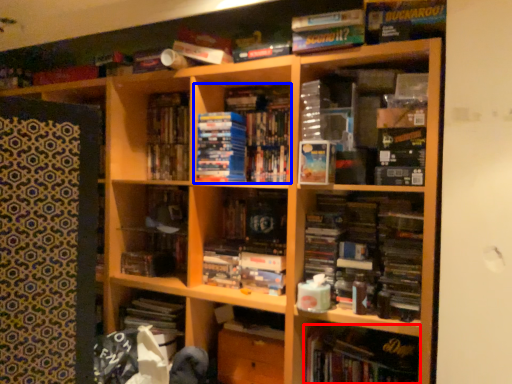
Question: Among these objects, which one is farthest to the camera, book (highlighted by a red box) or book (highlighted by a blue box)?

Choices:
 (A) book
 (B) book

Answer: (B)